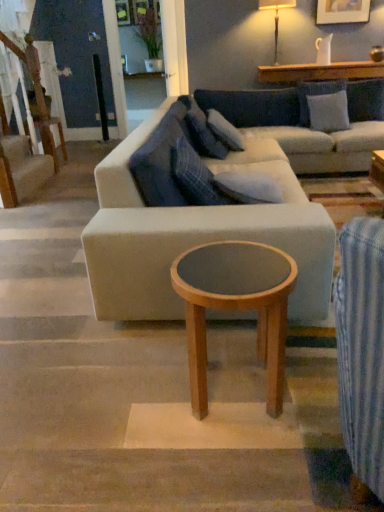
Identify the location of vacant position to the left of light brown wood coffee table at center. This screenshot has height=512, width=384. (129, 396).